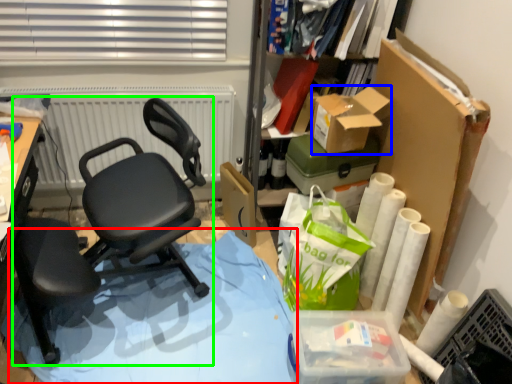
Question: Which object is the closest to the table (highlighted by a red box)? Choose among these: box (highlighted by a blue box) or chair (highlighted by a green box).

Choices:
 (A) box
 (B) chair

Answer: (B)